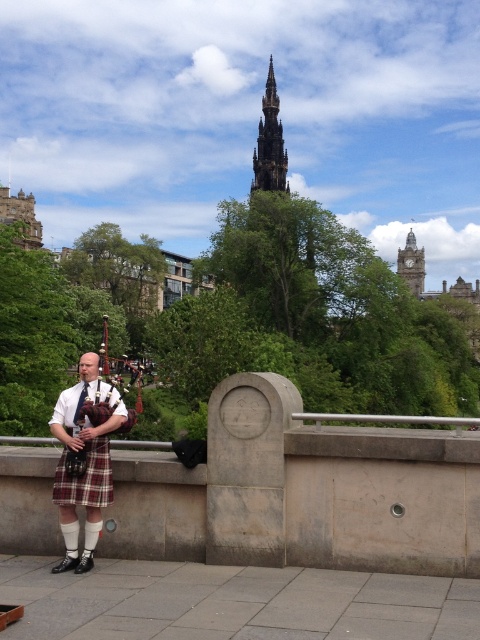
Question: Does plaid fabric kilt at left have a smaller size compared to polished wood bagpipes at left?

Choices:
 (A) yes
 (B) no

Answer: (A)

Question: Which object is closer to the camera taking this photo?

Choices:
 (A) plaid kilt at center
 (B) dark brown stone spire at upper center
 (C) polished wood bagpipes at left
 (D) plaid fabric kilt at left

Answer: (A)

Question: Which point appears farthest from the camera in this image?

Choices:
 (A) (80, 422)
 (B) (93, 467)
 (C) (108, 416)
 (D) (271, 172)

Answer: (D)

Question: Which of these objects is positioned farthest from the polished wood bagpipes at left?

Choices:
 (A) dark brown stone spire at upper center
 (B) plaid fabric kilt at left

Answer: (A)

Question: Is plaid kilt at center smaller than dark brown stone spire at upper center?

Choices:
 (A) yes
 (B) no

Answer: (A)

Question: Is plaid kilt at center smaller than polished wood bagpipes at left?

Choices:
 (A) yes
 (B) no

Answer: (A)